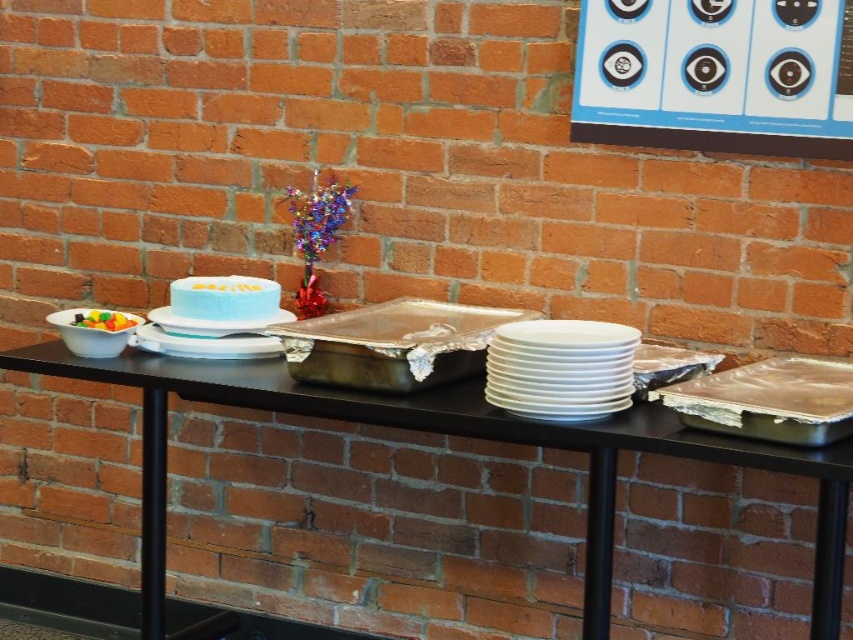
Who is lower down, silver metallic tray at center or white matte plate at center?

silver metallic tray at center is lower down.

Measure the distance between point (430,358) and camera.

A distance of 6.30 feet exists between point (430,358) and camera.

At what (x,y) coordinates should I click in order to perform the action: click on silver metallic tray at center. Please return your answer as a coordinate pair (x, y). This screenshot has height=640, width=853. Looking at the image, I should click on (392, 342).

Who is positioned more to the left, white matte plate stack at right or blue frosted cake at center?

blue frosted cake at center is more to the left.

Who is lower down, white matte plate stack at right or blue frosted cake at center?

white matte plate stack at right is below.

This screenshot has width=853, height=640. Find the location of `white matte plate stack at right`. white matte plate stack at right is located at coordinates (560, 369).

You are a GUI agent. You are given a task and a screenshot of the screen. Output one action in this format:
    pyautogui.click(x=<x>, y=<y>)
    Task: Click on the white matte plate stack at right
    The height and width of the screenshot is (640, 853).
    Given the screenshot: What is the action you would take?
    pyautogui.click(x=560, y=369)

Who is positioned more to the right, translucent plastic bowl at left or white frosted cake at center?

From the viewer's perspective, white frosted cake at center appears more on the right side.

Is translucent plastic bowl at left to the right of white frosted cake at center from the viewer's perspective?

Incorrect, translucent plastic bowl at left is not on the right side of white frosted cake at center.

Is point (109, 321) positioned behind point (223, 284)?

No, (109, 321) is in front of (223, 284).

In order to click on translucent plastic bowl at left in this screenshot , I will do `click(103, 321)`.